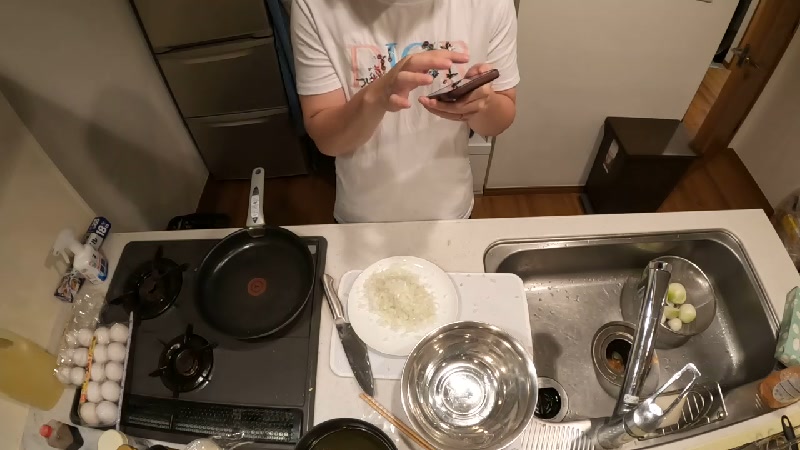
Locate an element on the screen. The width and height of the screenshot is (800, 450). phone is located at coordinates (452, 95).